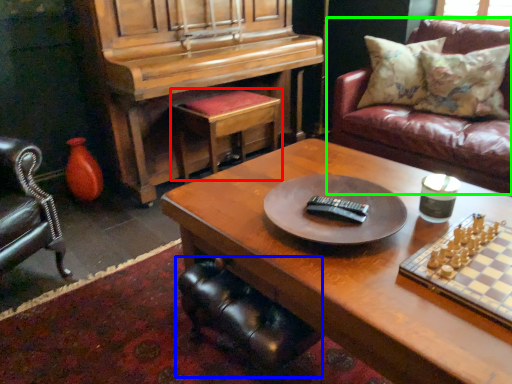
Question: Which object is positioned farthest from stool (highlighted by a red box)? Select from swivel chair (highlighted by a blue box) and studio couch (highlighted by a green box).

Choices:
 (A) swivel chair
 (B) studio couch

Answer: (A)